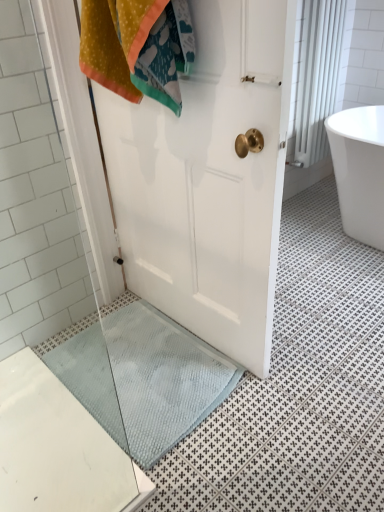
Question: Does point (329, 2) appear closer or farther from the camera than point (86, 357)?

Choices:
 (A) farther
 (B) closer

Answer: (A)

Question: From the image's perspective, is white textured curtain at upper right located above or below light blue textured bath mat at lower center?

Choices:
 (A) above
 (B) below

Answer: (A)

Question: Which object is the closest to the white textured curtain at upper right?

Choices:
 (A) white glossy bathtub at right
 (B) light blue textured bath mat at lower center

Answer: (A)

Question: Which of these objects is positioned farthest from the white textured curtain at upper right?

Choices:
 (A) light blue textured bath mat at lower center
 (B) white glossy bathtub at right

Answer: (A)